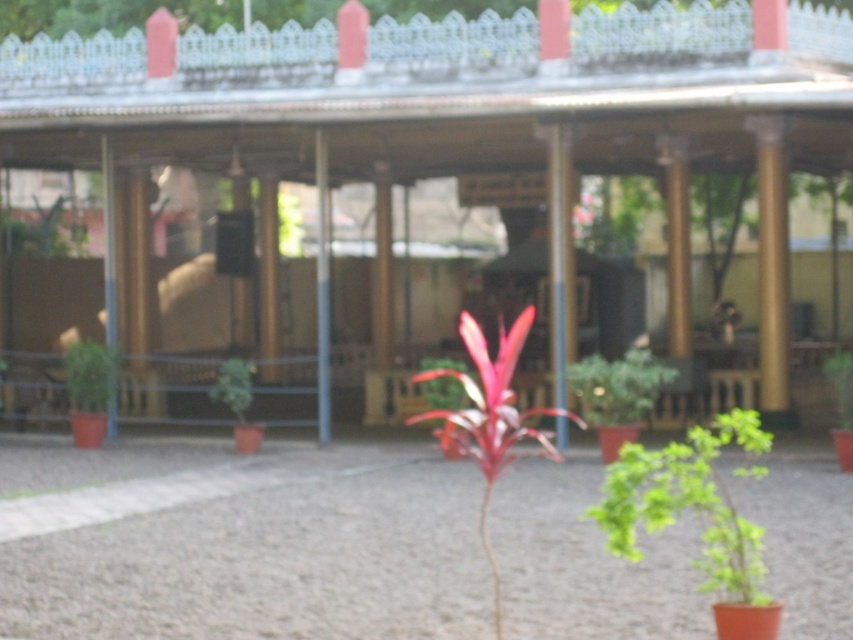
You are standing at the base of the porch and want to take a photo of both point (828, 35) and point (845, 381) in the image. Since the image is slightly blurred, you need to adjust your focus. Which point should you focus on first to ensure both are in focus?

You should focus on point (828, 35) first because it is closer to the camera than point (845, 381). By focusing on the closer point, the farther point will also be in focus due to the depth of field.

You are standing on the paved area and want to move towards the porch. Which plant, the green matte plant at lower right or the green leafy plant at center, is closer to you?

The green matte plant at lower right is closer to you since it is in front of the green leafy plant at center.